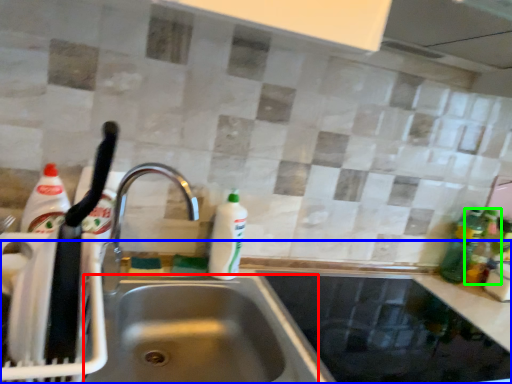
Question: Considering the real-world distances, which object is closest to sink (highlighted by a red box)? counter top (highlighted by a blue box) or bottle (highlighted by a green box).

Choices:
 (A) counter top
 (B) bottle

Answer: (A)